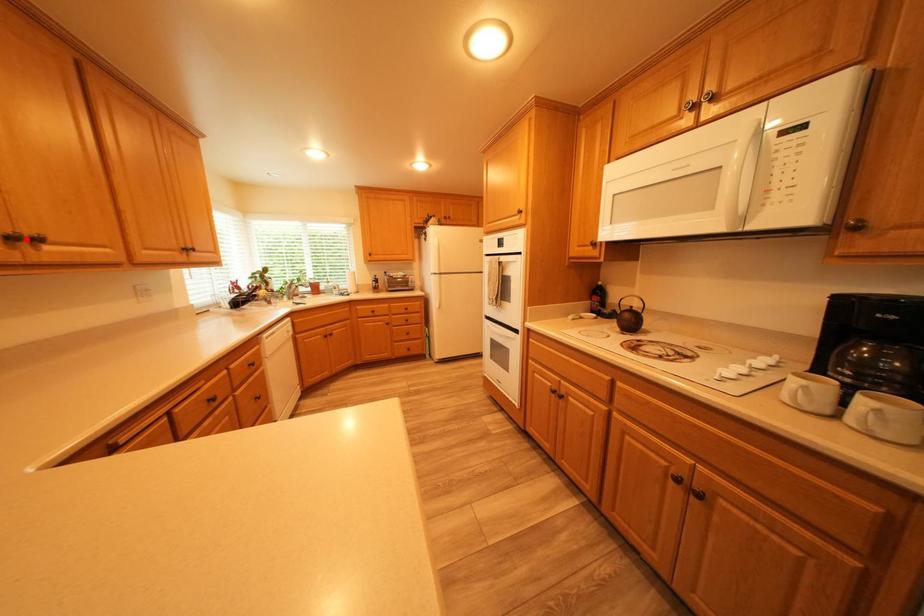
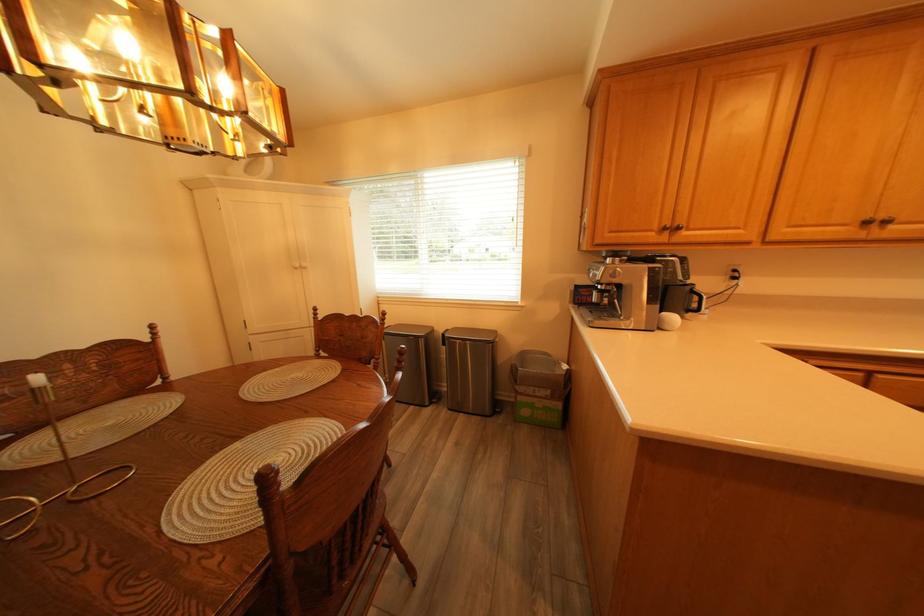
In the second image, find the point that corresponds to the highlighted location in the first image.

(881, 224)